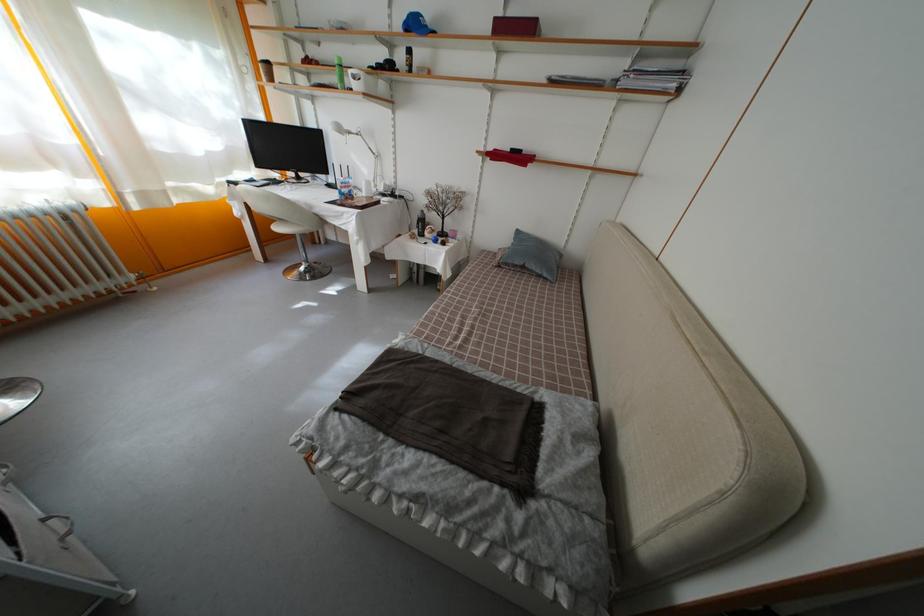
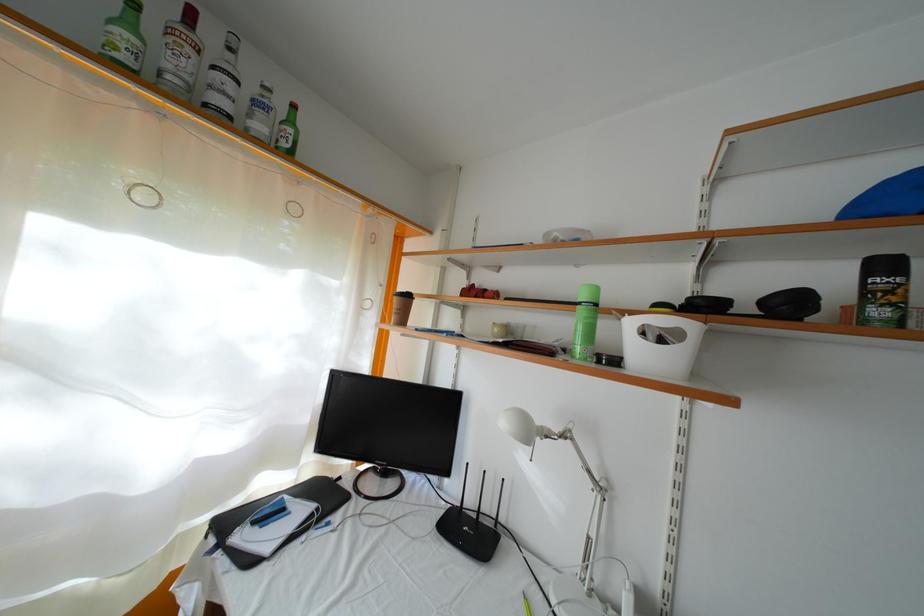
The point at (x=346, y=136) is marked in the first image. Where is the corresponding point in the second image?

(535, 439)